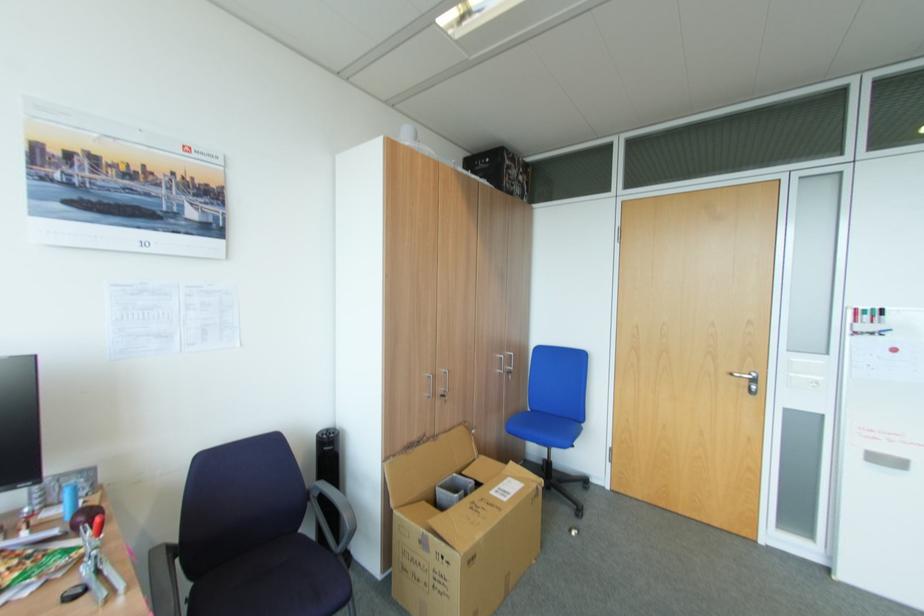
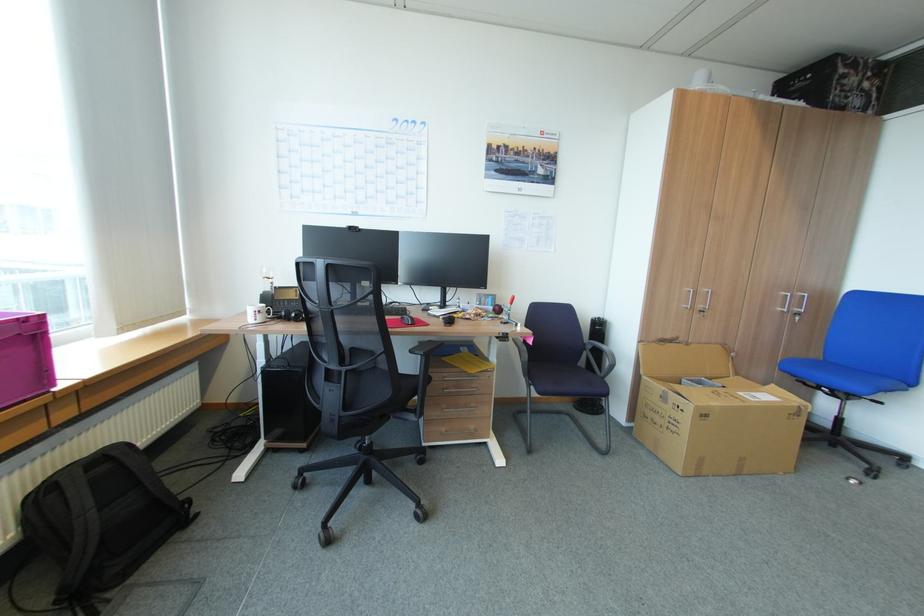
In the second image, find the point that corresponds to point 312,487 in the first image.

(590, 342)